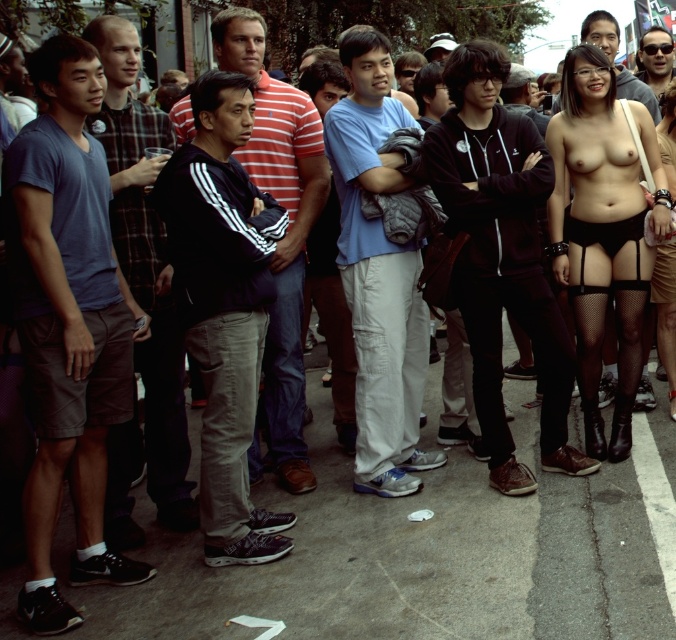
Question: Does black matte hoodie at center have a greater width compared to black matte bikini top at right?

Choices:
 (A) yes
 (B) no

Answer: (A)

Question: Which object is the closest to the black matte hoodie at center?

Choices:
 (A) matte black jacket at center
 (B) light blue cotton t-shirt at left
 (C) black adidas jacket at center
 (D) shiny black sunglasses at upper right

Answer: (C)

Question: In this image, where is black matte bikini top at right located relative to black adidas jacket at center?

Choices:
 (A) below
 (B) above

Answer: (B)

Question: Is black matte hoodie at center bigger than light blue cotton shirt at center?

Choices:
 (A) yes
 (B) no

Answer: (A)

Question: Estimate the real-world distances between objects in this image. Which object is farther from the matte black jacket at center?

Choices:
 (A) light blue cotton t-shirt at left
 (B) shiny black sunglasses at upper right

Answer: (A)

Question: Which point appears farthest from the camera in this image?

Choices:
 (A) (289, 282)
 (B) (646, 35)
 (C) (28, 602)
 (D) (635, 83)

Answer: (B)